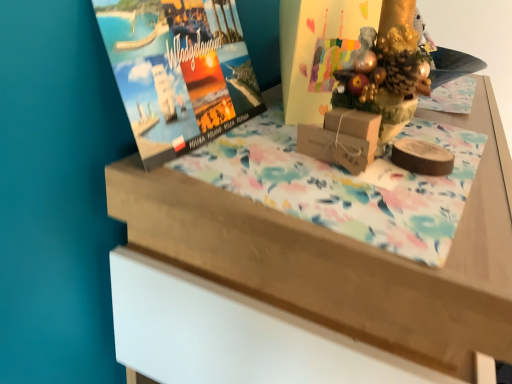
Where is `free spot to the right of brown cardboard box at center`? This screenshot has width=512, height=384. free spot to the right of brown cardboard box at center is located at coordinates (458, 187).